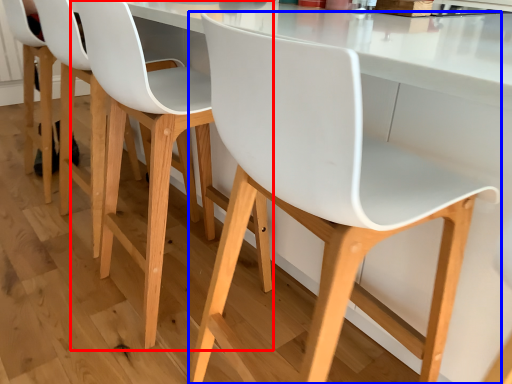
Question: Which object is further to the camera taking this photo, chair (highlighted by a red box) or chair (highlighted by a blue box)?

Choices:
 (A) chair
 (B) chair

Answer: (A)